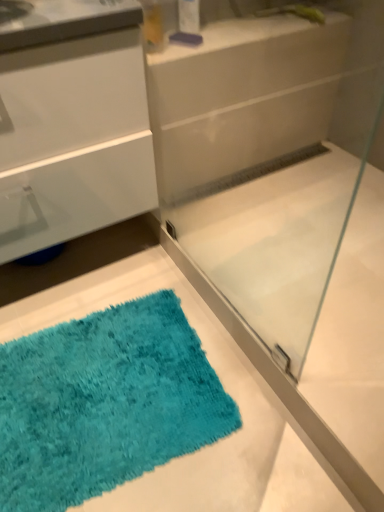
The width and height of the screenshot is (384, 512). Identify the location of empty space that is ontop of white glossy counter at upper center (from a real-world perspective). (255, 26).